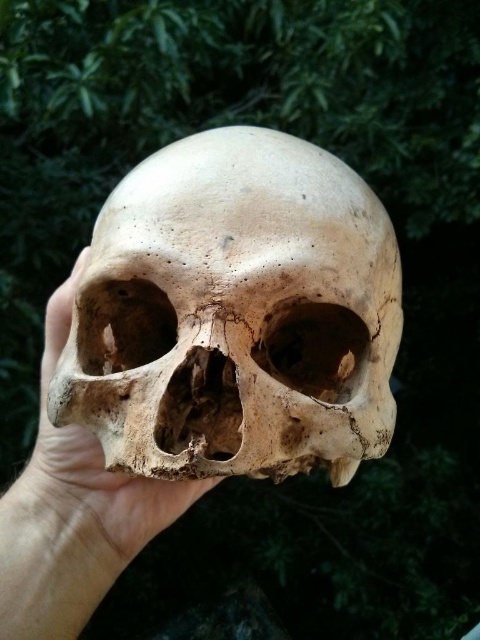
Question: Which point appears closest to the camera in this image?

Choices:
 (A) (34, 508)
 (B) (349, 340)

Answer: (B)

Question: Which point is farther to the camera?

Choices:
 (A) (175, 512)
 (B) (214, 129)

Answer: (B)

Question: Can you confirm if matte bone skull at center is thinner than smooth beige skull at center?

Choices:
 (A) no
 (B) yes

Answer: (A)

Question: Can you confirm if matte bone skull at center is thinner than smooth beige skull at center?

Choices:
 (A) yes
 (B) no

Answer: (B)

Question: In this image, where is matte bone skull at center located relative to smooth beige skull at center?

Choices:
 (A) left
 (B) right

Answer: (B)